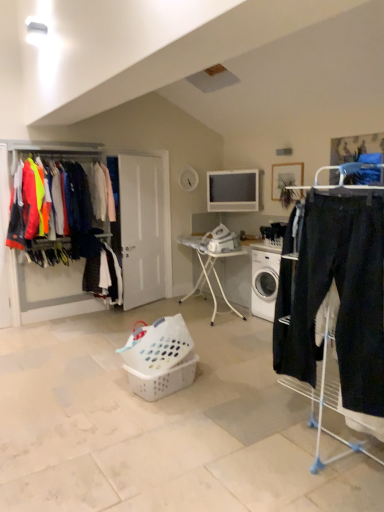
Question: Is dark blue fabric pants at center, the second clothing viewed from the left, smaller than dark blue jeans at right, placed as the third clothing when sorted from back to front?

Choices:
 (A) yes
 (B) no

Answer: (B)

Question: Does dark blue fabric pants at center, the second clothing viewed from the left, have a lesser width compared to dark blue jeans at right, acting as the first clothing starting from the front?

Choices:
 (A) yes
 (B) no

Answer: (B)

Question: Can you confirm if dark blue fabric pants at center, the second clothing viewed from the left, is positioned to the right of dark blue jeans at right, acting as the third clothing starting from the left?

Choices:
 (A) no
 (B) yes

Answer: (A)

Question: From a real-world perspective, is dark blue fabric pants at center, the 2th clothing positioned from the right, over dark blue jeans at right, acting as the third clothing starting from the left?

Choices:
 (A) no
 (B) yes

Answer: (A)

Question: Can you confirm if dark blue fabric pants at center, the 2th clothing positioned from the right, is taller than dark blue jeans at right, acting as the third clothing starting from the left?

Choices:
 (A) no
 (B) yes

Answer: (A)

Question: Considering the relative sizes of dark blue fabric pants at center, the second clothing viewed from the left, and dark blue jeans at right, acting as the first clothing starting from the front, in the image provided, is dark blue fabric pants at center, the second clothing viewed from the left, shorter than dark blue jeans at right, acting as the first clothing starting from the front,?

Choices:
 (A) yes
 (B) no

Answer: (A)

Question: Does white matte door at center have a greater width compared to white metal ironing board at center?

Choices:
 (A) yes
 (B) no

Answer: (B)

Question: Considering the relative sizes of white matte door at center and white metal ironing board at center in the image provided, is white matte door at center shorter than white metal ironing board at center?

Choices:
 (A) no
 (B) yes

Answer: (A)

Question: Considering the relative sizes of white matte door at center and white metal ironing board at center in the image provided, is white matte door at center bigger than white metal ironing board at center?

Choices:
 (A) yes
 (B) no

Answer: (B)

Question: Is white matte door at center at the left side of white metal ironing board at center?

Choices:
 (A) no
 (B) yes

Answer: (B)

Question: Can you confirm if white matte door at center is smaller than white metal ironing board at center?

Choices:
 (A) no
 (B) yes

Answer: (B)

Question: Is white matte door at center oriented towards white metal ironing board at center?

Choices:
 (A) no
 (B) yes

Answer: (B)

Question: Considering the relative sizes of white plastic lampshade at upper center and white plastic basket at center, acting as the second basket starting from the top, in the image provided, is white plastic lampshade at upper center taller than white plastic basket at center, acting as the second basket starting from the top,?

Choices:
 (A) no
 (B) yes

Answer: (A)